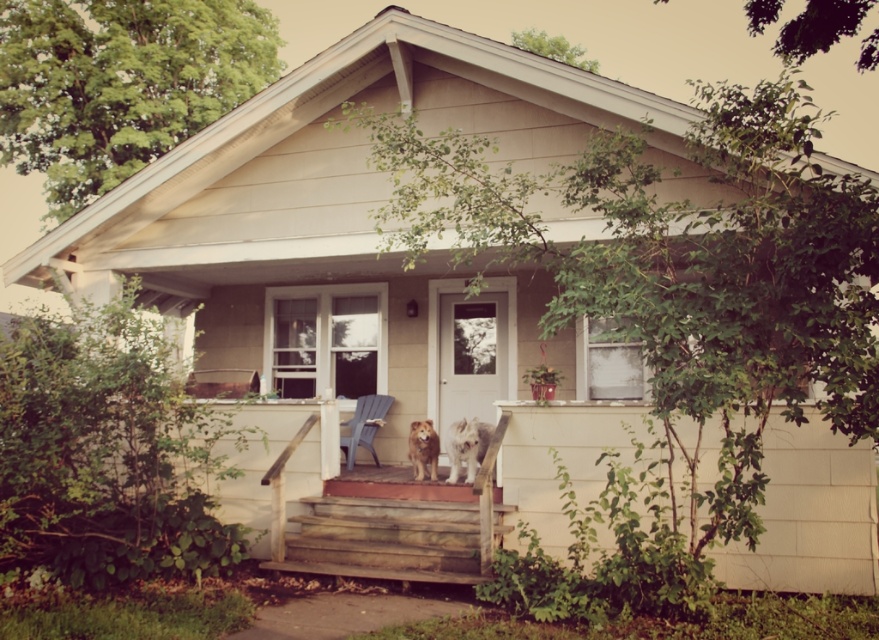
In the scene shown: Does wooden stairs at center have a smaller size compared to brown furry dog at center?

Actually, wooden stairs at center might be larger than brown furry dog at center.

Is wooden stairs at center thinner than brown furry dog at center?

No, wooden stairs at center is not thinner than brown furry dog at center.

Locate an element on the screen. The width and height of the screenshot is (879, 640). wooden stairs at center is located at coordinates (398, 532).

Locate an element on the screen. wooden stairs at center is located at coordinates (398, 532).

Does wooden stairs at center have a greater width compared to wooden bench at center?

Correct, the width of wooden stairs at center exceeds that of wooden bench at center.

The width and height of the screenshot is (879, 640). In order to click on wooden stairs at center in this screenshot , I will do `click(398, 532)`.

Is wooden stairs at center thinner than white matte screen door at center?

Incorrect, wooden stairs at center's width is not less than white matte screen door at center's.

Based on the photo, can you confirm if wooden stairs at center is bigger than white matte screen door at center?

Correct, wooden stairs at center is larger in size than white matte screen door at center.

Locate an element on the screen. The image size is (879, 640). wooden stairs at center is located at coordinates (398, 532).